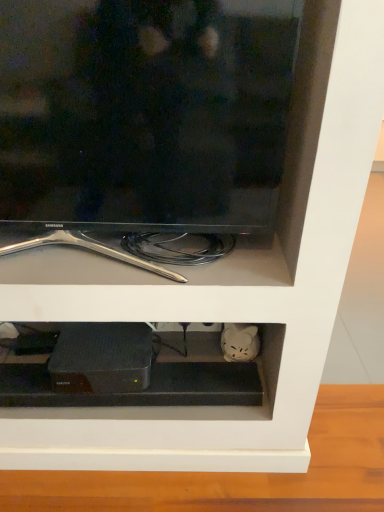
Question: Does black glossy tv at upper center have a greater width compared to black matte router at lower center?

Choices:
 (A) no
 (B) yes

Answer: (A)

Question: Is black glossy tv at upper center further to camera compared to black matte router at lower center?

Choices:
 (A) no
 (B) yes

Answer: (A)

Question: Can you confirm if black glossy tv at upper center is smaller than black matte router at lower center?

Choices:
 (A) yes
 (B) no

Answer: (B)

Question: Is black glossy tv at upper center taller than black matte router at lower center?

Choices:
 (A) no
 (B) yes

Answer: (B)

Question: Considering the relative sizes of black glossy tv at upper center and black matte router at lower center in the image provided, is black glossy tv at upper center bigger than black matte router at lower center?

Choices:
 (A) yes
 (B) no

Answer: (A)

Question: Could you tell me if black glossy tv at upper center is turned towards black matte router at lower center?

Choices:
 (A) yes
 (B) no

Answer: (B)

Question: Is black matte router at lower center far from black matte device at center?

Choices:
 (A) no
 (B) yes

Answer: (A)

Question: Considering the relative sizes of black matte router at lower center and black matte device at center in the image provided, is black matte router at lower center wider than black matte device at center?

Choices:
 (A) no
 (B) yes

Answer: (A)

Question: Is black matte router at lower center facing away from black matte device at center?

Choices:
 (A) yes
 (B) no

Answer: (B)

Question: Can you see black matte router at lower center touching black matte device at center?

Choices:
 (A) yes
 (B) no

Answer: (A)

Question: Is the depth of black matte router at lower center greater than that of black matte device at center?

Choices:
 (A) yes
 (B) no

Answer: (B)

Question: Does black matte router at lower center have a lesser height compared to black matte device at center?

Choices:
 (A) no
 (B) yes

Answer: (A)

Question: From a real-world perspective, is black matte router at lower center on top of black glossy tv at upper center?

Choices:
 (A) yes
 (B) no

Answer: (B)